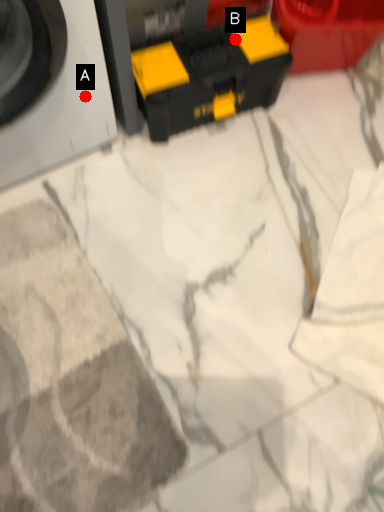
Question: Two points are circled on the image, labeled by A and B beside each circle. Which point is farther from the camera taking this photo?

Choices:
 (A) A is further
 (B) B is further

Answer: (B)